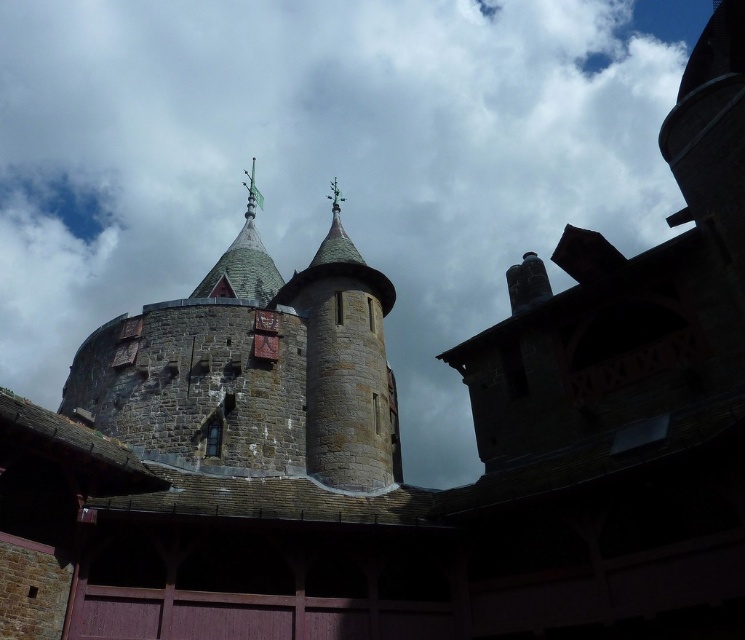
Is white fluffy cloud at upper center smaller than stone tower at upper center?

Actually, white fluffy cloud at upper center might be larger than stone tower at upper center.

Identify the location of white fluffy cloud at upper center. This screenshot has width=745, height=640. (323, 161).